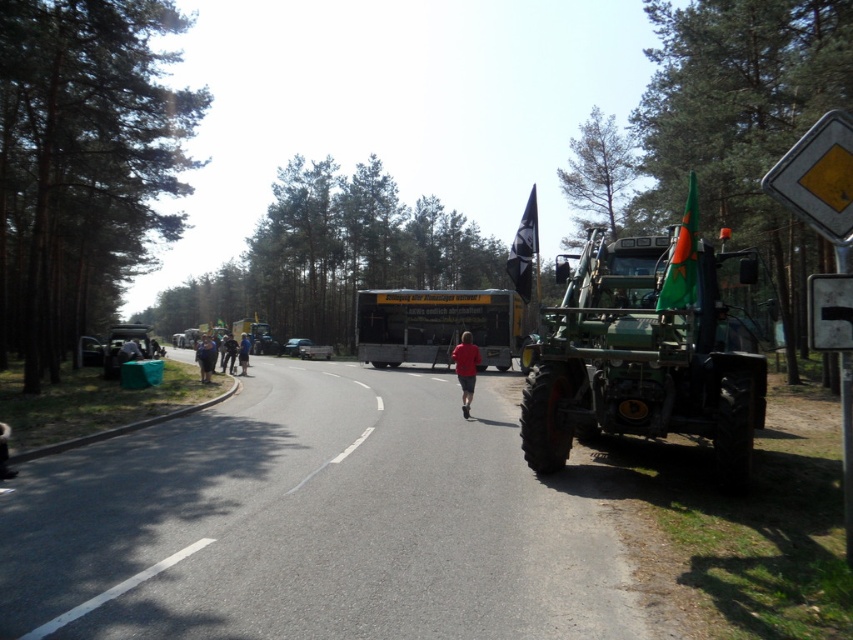
Question: Which of the following is the farthest from the observer?

Choices:
 (A) (512, 248)
 (B) (225, 339)

Answer: (B)

Question: Can you confirm if metallic silver trailer at left is positioned below red matte shirt at center?

Choices:
 (A) yes
 (B) no

Answer: (B)

Question: Which point is closer to the camera?

Choices:
 (A) (306, 348)
 (B) (679, 385)
 (C) (460, 348)
 (D) (247, 352)

Answer: (B)

Question: Can you confirm if green matte tractor at right is positioned to the left of metallic silver car at center?

Choices:
 (A) no
 (B) yes

Answer: (A)

Question: Is metallic silver trailer at left behind dark blue fabric jacket at center?

Choices:
 (A) yes
 (B) no

Answer: (B)

Question: Which object is closer to the camera taking this photo?

Choices:
 (A) red matte shirt at center
 (B) metallic silver trailer at left
 (C) yellow matte truck at center

Answer: (A)